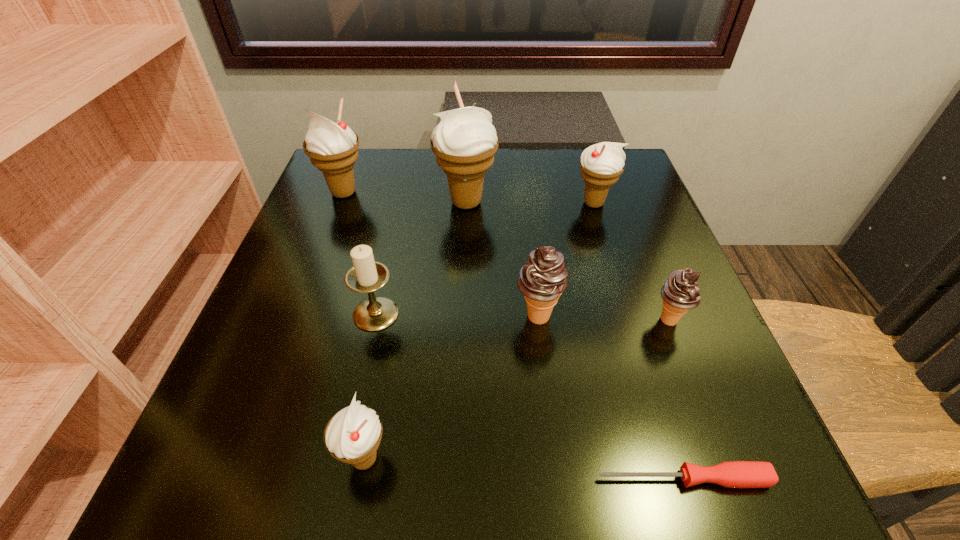
Locate an element on the screen. The height and width of the screenshot is (540, 960). the nearest white icecream is located at coordinates point(352,435).

At what (x,y) coordinates should I click in order to perform the action: click on the shortest object. Please return your answer as a coordinate pair (x, y). The image size is (960, 540). Looking at the image, I should click on (735, 474).

You are a GUI agent. You are given a task and a screenshot of the screen. Output one action in this format:
    pyautogui.click(x=<x>, y=<y>)
    Task: Click on the free space located on the front of the tallest object
    Image resolution: width=960 pixels, height=540 pixels.
    Given the screenshot: What is the action you would take?
    pyautogui.click(x=464, y=269)

The image size is (960, 540). Identify the location of vacant space located 0.100m on the right of the leftmost white icecream. (411, 193).

Identify the location of vacant area located on the front of the second smallest white icecream. The height and width of the screenshot is (540, 960). (626, 309).

Locate an element on the screen. The image size is (960, 540). free region located 0.160m on the right of the fifth object from left to right is located at coordinates (654, 316).

The width and height of the screenshot is (960, 540). Identify the location of free region located 0.280m on the back of the white candle holder. (399, 205).

Image resolution: width=960 pixels, height=540 pixels. In order to click on vacant space located on the front of the smaller chocolate icecream in this screenshot , I will do (705, 411).

Locate an element on the screen. The width and height of the screenshot is (960, 540). vacant space located 0.280m on the back of the second white icecream from left to right is located at coordinates (396, 288).

Where is `vacant space located at the tip of the screwdriver`? The height and width of the screenshot is (540, 960). vacant space located at the tip of the screwdriver is located at coordinates (551, 478).